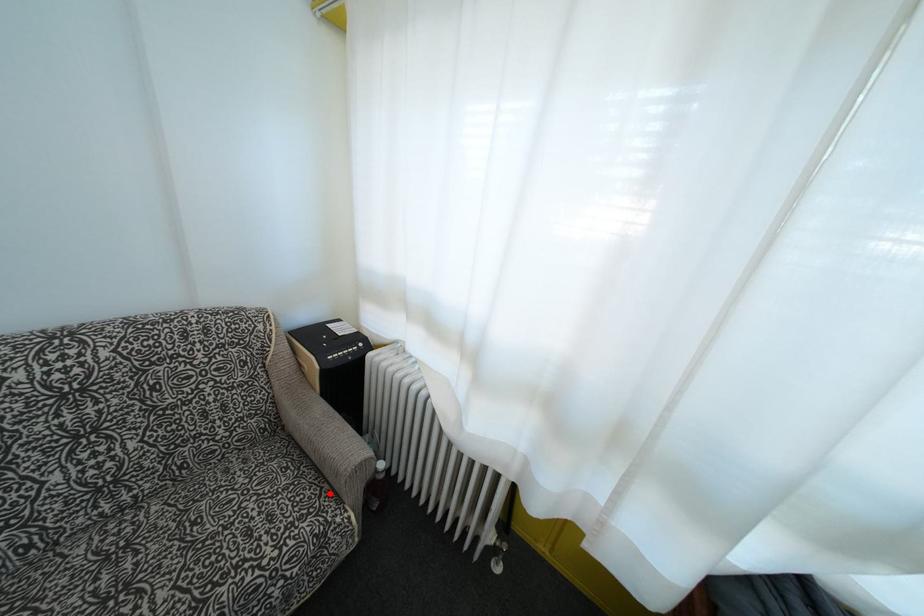
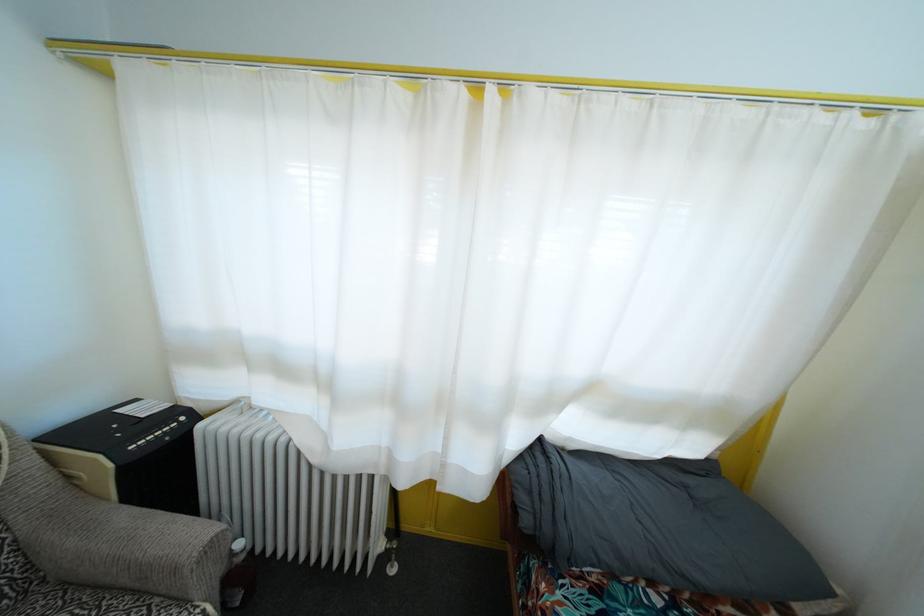
Question: I am providing you with two images of the same scene from different viewpoints. Given a red point in image1, look at the same physical point in image2. Is it:

Choices:
 (A) Closer to the viewpoint
 (B) Farther from the viewpoint

Answer: (A)